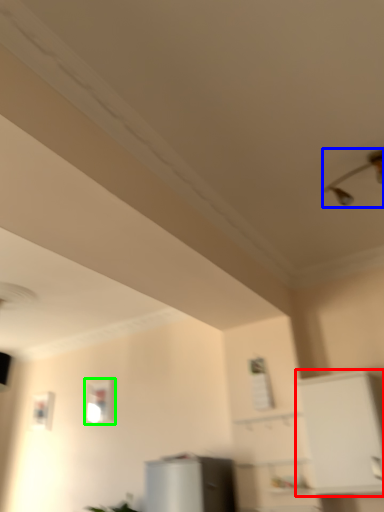
Question: Considering the real-world distances, which object is farthest from cabinetry (highlighted by a red box)? light fixture (highlighted by a blue box) or window (highlighted by a green box)?

Choices:
 (A) light fixture
 (B) window

Answer: (B)